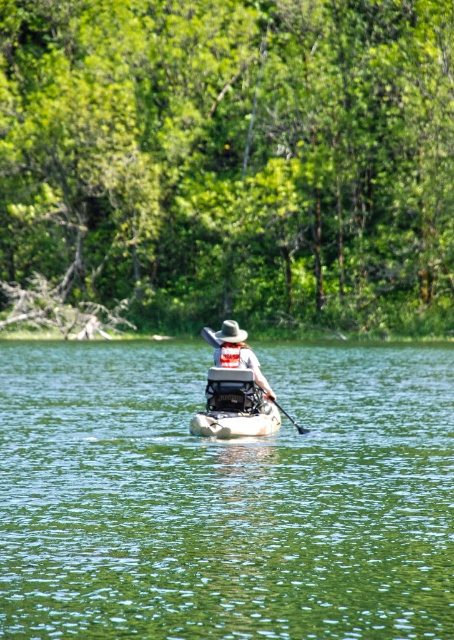
You are a photographer trying to capture the kayaker in the scene. You notice two points marked on your screen at coordinates point (217, 364) and point (220, 355). Which point should you focus on to ensure the kayaker is in sharp focus?

You should focus on point (217, 364) because it is closer to the camera than point (220, 355), ensuring the kayaker appears in sharp focus.

You are planning to store the wooden paddle at center and the white plastic canoe at center in a storage room. The storage room has a height limit of 1.5 meters. Can both items be stored vertically without exceeding the height limit?

A: The wooden paddle at center is bigger than the white plastic canoe at center. Since the wooden paddle at center is larger, it might exceed the 1.5 meters height limit when stored vertically. Therefore, it is uncertain if both can be stored without exceeding the limit without knowing their exact dimensions.

From the picture: What is the exact coordinate of the wooden paddle at center in the image?

The wooden paddle at center is located at coordinate point (236, 388).